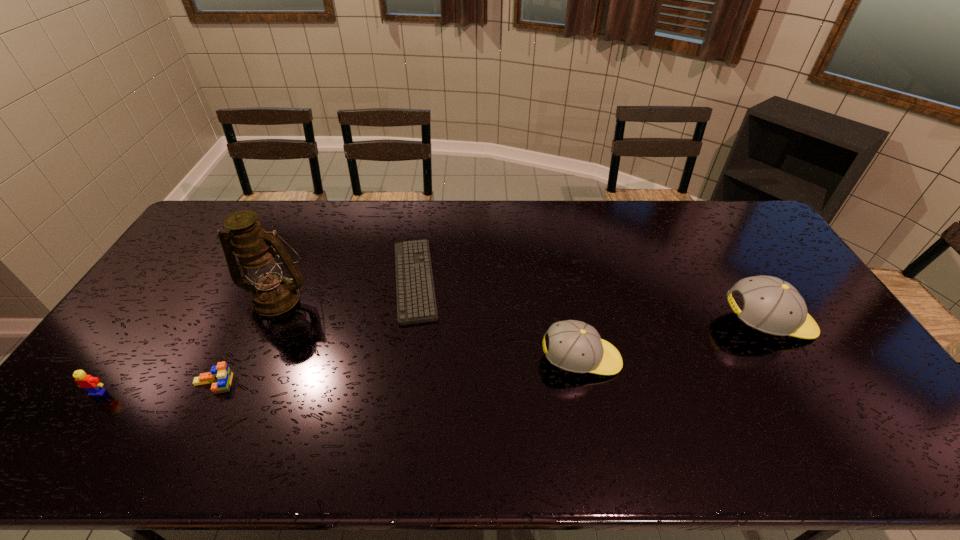
Locate an element on the screen. The height and width of the screenshot is (540, 960). the shorter baseball cap is located at coordinates (574, 346).

Locate an element on the screen. the left baseball cap is located at coordinates (574, 346).

This screenshot has height=540, width=960. What are the coordinates of `the rightmost object` in the screenshot? It's located at (773, 306).

Where is `the taller baseball cap`? the taller baseball cap is located at coordinates (773, 306).

At what (x,y) coordinates should I click in order to perform the action: click on computer keyboard. Please return your answer as a coordinate pair (x, y). This screenshot has height=540, width=960. Looking at the image, I should click on (416, 303).

I want to click on the shortest object, so click(x=416, y=303).

I want to click on the right Lego, so click(221, 373).

At what (x,y) coordinates should I click in order to perform the action: click on the shorter Lego. Please return your answer as a coordinate pair (x, y). Looking at the image, I should click on coord(221,373).

Image resolution: width=960 pixels, height=540 pixels. Identify the location of the tallest object. (272, 294).

Locate an element on the screen. The image size is (960, 540). the taller Lego is located at coordinates (92, 384).